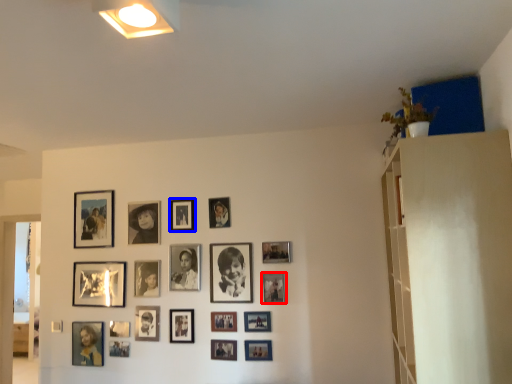
Question: Which point is closer to the camera, picture frame (highlighted by a red box) or picture frame (highlighted by a blue box)?

Choices:
 (A) picture frame
 (B) picture frame

Answer: (A)